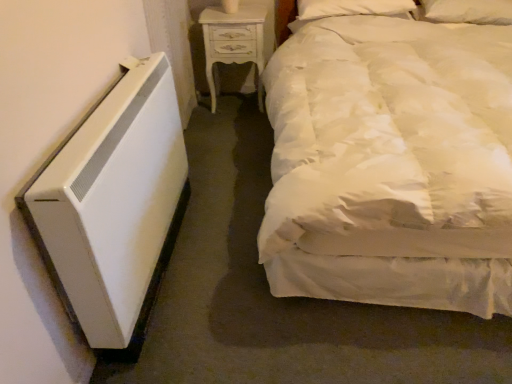
Describe the element at coordinates (391, 164) in the screenshot. I see `white satin bed at right` at that location.

Find the location of a particular element. white soft pillow at upper right, which ranks as the 2th pillow in right-to-left order is located at coordinates (354, 8).

In order to face white soft pillow at upper right, the first pillow positioned from the left, should I rotate leftwards or rightwards?

Rotate right and turn 12.783 degrees.

Locate an element on the screen. The width and height of the screenshot is (512, 384). white satin bed at right is located at coordinates coord(391,164).

From a real-world perspective, is white soft pillow at upper right, positioned as the 1th pillow in right-to-left order, under white soft pillow at upper right, the first pillow positioned from the left?

Yes, from a real-world perspective, white soft pillow at upper right, positioned as the 1th pillow in right-to-left order, is under white soft pillow at upper right, the first pillow positioned from the left.

Is white soft pillow at upper right, which ranks as the second pillow in left-to-right order, positioned far away from white soft pillow at upper right, the first pillow positioned from the left?

They are positioned close to each other.

Is white soft pillow at upper right, which ranks as the second pillow in left-to-right order, in front of or behind white soft pillow at upper right, which ranks as the 2th pillow in right-to-left order, in the image?

In the image, white soft pillow at upper right, which ranks as the second pillow in left-to-right order, appears in front of white soft pillow at upper right, which ranks as the 2th pillow in right-to-left order.

Locate an element on the screen. pillow behind the white soft pillow at upper right, which ranks as the second pillow in left-to-right order is located at coordinates (354, 8).

Looking at this image, from their relative heights in the image, would you say white painted wood nightstand at upper center is taller or shorter than white satin bed at right?

white painted wood nightstand at upper center is shorter than white satin bed at right.

Between white painted wood nightstand at upper center and white satin bed at right, which one is positioned in front?

white satin bed at right.

Where is `bed above the white painted wood nightstand at upper center (from a real-world perspective)`? bed above the white painted wood nightstand at upper center (from a real-world perspective) is located at coordinates (391, 164).

From the image's perspective, who appears lower, white satin bed at right or white soft pillow at upper right, the first pillow positioned from the left?

From the image's view, white satin bed at right is below.

Is white satin bed at right placed right next to white soft pillow at upper right, which ranks as the 2th pillow in right-to-left order?

white satin bed at right is not next to white soft pillow at upper right, which ranks as the 2th pillow in right-to-left order, and they're not touching.

At what (x,y) coordinates should I click in order to perform the action: click on bed located underneath the white soft pillow at upper right, which ranks as the 2th pillow in right-to-left order (from a real-world perspective). Please return your answer as a coordinate pair (x, y). Looking at the image, I should click on (391, 164).

Considering the relative positions of white satin bed at right and white painted wood nightstand at upper center in the image provided, is white satin bed at right to the left of white painted wood nightstand at upper center from the viewer's perspective?

No, white satin bed at right is not to the left of white painted wood nightstand at upper center.

Is white painted wood nightstand at upper center a part of white satin bed at right?

No.

Which object is thinner, white satin bed at right or white painted wood nightstand at upper center?

white painted wood nightstand at upper center is thinner.

Can you tell me how much white satin bed at right and white painted wood nightstand at upper center differ in facing direction?

The facing directions of white satin bed at right and white painted wood nightstand at upper center are 0.208 degrees apart.

Who is shorter, white soft pillow at upper right, which ranks as the second pillow in left-to-right order, or white painted wood nightstand at upper center?

white soft pillow at upper right, which ranks as the second pillow in left-to-right order.

Identify the location of nightstand behind the white soft pillow at upper right, which ranks as the second pillow in left-to-right order. (238, 40).

Does point (458, 13) come farther from viewer compared to point (258, 72)?

No, (458, 13) is closer to viewer.

How many degrees apart are the facing directions of white painted wood nightstand at upper center and white soft pillow at upper right, which ranks as the 2th pillow in right-to-left order?

0.749 degrees.

From the image's perspective, which object appears higher, white painted wood nightstand at upper center or white soft pillow at upper right, the first pillow positioned from the left?

white soft pillow at upper right, the first pillow positioned from the left, appears higher in the image.

Is white painted wood nightstand at upper center aimed at white soft pillow at upper right, the first pillow positioned from the left?

No, white painted wood nightstand at upper center is not facing towards white soft pillow at upper right, the first pillow positioned from the left.

Is white painted wood nightstand at upper center positioned behind white soft pillow at upper right, which ranks as the 2th pillow in right-to-left order?

That is True.

Starting from the white painted wood nightstand at upper center, which pillow is the 1st one in front? Please provide its 2D coordinates.

[(354, 8)]

Which is more to the left, white soft pillow at upper right, which ranks as the 2th pillow in right-to-left order, or white painted wood nightstand at upper center?

Positioned to the left is white painted wood nightstand at upper center.

Which of these two, white soft pillow at upper right, which ranks as the 2th pillow in right-to-left order, or white painted wood nightstand at upper center, is wider?

white soft pillow at upper right, which ranks as the 2th pillow in right-to-left order.

Where is `pillow above the white soft pillow at upper right, which ranks as the second pillow in left-to-right order (from the image's perspective)`? The height and width of the screenshot is (384, 512). pillow above the white soft pillow at upper right, which ranks as the second pillow in left-to-right order (from the image's perspective) is located at coordinates (354, 8).

Where is `bed lying on the right of white painted wood nightstand at upper center`? bed lying on the right of white painted wood nightstand at upper center is located at coordinates (391, 164).

Based on their spatial positions, is white painted wood nightstand at upper center or white satin bed at right further from white soft pillow at upper right, which ranks as the 2th pillow in right-to-left order?

Based on the image, white satin bed at right appears to be further to white soft pillow at upper right, which ranks as the 2th pillow in right-to-left order.

From the image, which object appears to be nearer to white soft pillow at upper right, the first pillow positioned from the left, white satin bed at right or white painted wood nightstand at upper center?

white painted wood nightstand at upper center lies closer to white soft pillow at upper right, the first pillow positioned from the left, than the other object.

From the image, which object appears to be nearer to white soft pillow at upper right, which ranks as the 2th pillow in right-to-left order, white painted wood nightstand at upper center or white soft pillow at upper right, which ranks as the second pillow in left-to-right order?

Based on the image, white soft pillow at upper right, which ranks as the second pillow in left-to-right order, appears to be nearer to white soft pillow at upper right, which ranks as the 2th pillow in right-to-left order.

Looking at the image, which one is located further to white soft pillow at upper right, positioned as the 1th pillow in right-to-left order, white painted wood nightstand at upper center or white soft pillow at upper right, which ranks as the 2th pillow in right-to-left order?

white painted wood nightstand at upper center is further to white soft pillow at upper right, positioned as the 1th pillow in right-to-left order.

Based on the photo, from the image, which object appears to be farther from white soft pillow at upper right, which ranks as the 2th pillow in right-to-left order, white soft pillow at upper right, positioned as the 1th pillow in right-to-left order, or white painted wood nightstand at upper center?

The object further to white soft pillow at upper right, which ranks as the 2th pillow in right-to-left order, is white painted wood nightstand at upper center.

When comparing their distances from white soft pillow at upper right, positioned as the 1th pillow in right-to-left order, does white painted wood nightstand at upper center or white satin bed at right seem closer?

The object closer to white soft pillow at upper right, positioned as the 1th pillow in right-to-left order, is white painted wood nightstand at upper center.

Based on their spatial positions, is white satin bed at right or white soft pillow at upper right, which ranks as the second pillow in left-to-right order, closer to white painted wood nightstand at upper center?

white soft pillow at upper right, which ranks as the second pillow in left-to-right order.

Looking at the image, which one is located further to white soft pillow at upper right, the first pillow positioned from the left, white satin bed at right or white soft pillow at upper right, positioned as the 1th pillow in right-to-left order?

white satin bed at right is positioned further to the anchor white soft pillow at upper right, the first pillow positioned from the left.

At what (x,y) coordinates should I click in order to perform the action: click on pillow between white satin bed at right and white soft pillow at upper right, the first pillow positioned from the left, along the z-axis. Please return your answer as a coordinate pair (x, y). Image resolution: width=512 pixels, height=384 pixels. Looking at the image, I should click on pyautogui.click(x=468, y=11).

Where is `pillow situated between white painted wood nightstand at upper center and white soft pillow at upper right, which ranks as the second pillow in left-to-right order, from left to right`? pillow situated between white painted wood nightstand at upper center and white soft pillow at upper right, which ranks as the second pillow in left-to-right order, from left to right is located at coordinates (354, 8).